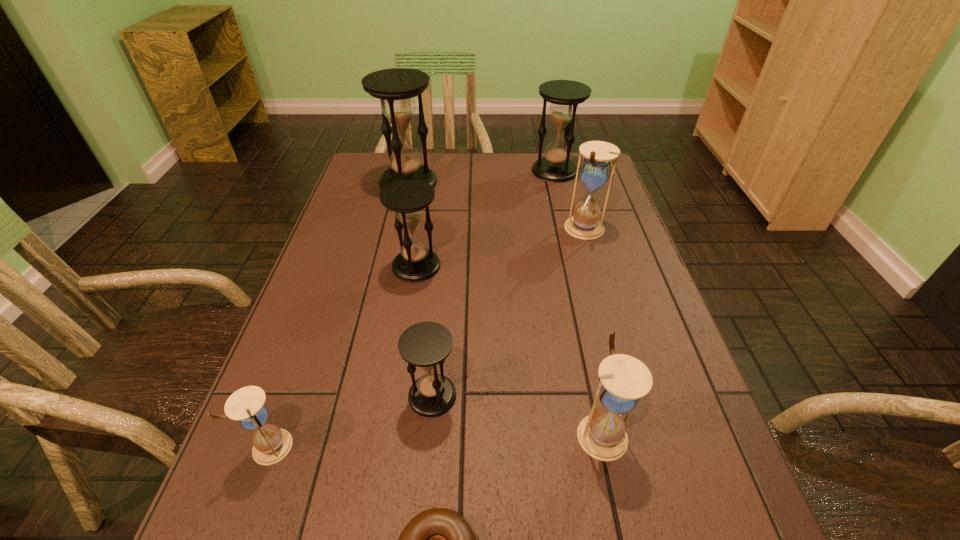
Where is `the tallest hourglass`? This screenshot has width=960, height=540. the tallest hourglass is located at coordinates (396, 87).

You are a GUI agent. You are given a task and a screenshot of the screen. Output one action in this format:
    pyautogui.click(x=<x>, y=<y>)
    Task: Click on the tallest object
    The width and height of the screenshot is (960, 540).
    Given the screenshot: What is the action you would take?
    pyautogui.click(x=396, y=87)

Identify the location of the third smallest black hourglass. (564, 95).

Identify the location of the biggest white hourglass. Image resolution: width=960 pixels, height=540 pixels. (595, 170).

Find the location of a particular element. Image resolution: width=960 pixels, height=540 pixels. the sixth nearest object is located at coordinates (595, 170).

Find the location of `the fourth farthest hourglass`. the fourth farthest hourglass is located at coordinates (407, 198).

I want to click on the second smallest black hourglass, so click(x=407, y=198).

Where is `the second biggest white hourglass`? The image size is (960, 540). the second biggest white hourglass is located at coordinates (624, 379).

The height and width of the screenshot is (540, 960). What are the coordinates of `the leftmost object` in the screenshot? It's located at (247, 406).

This screenshot has width=960, height=540. In order to click on the leftmost hourglass in this screenshot , I will do `click(247, 406)`.